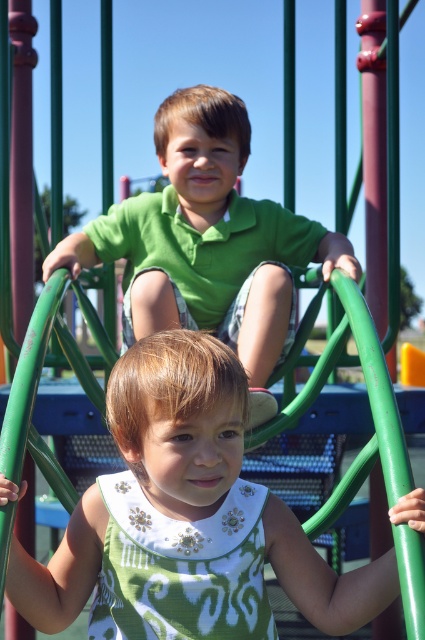
Is point (206, 404) positioned in front of point (303, 221)?

Yes, it is in front of point (303, 221).

Is green fabric dress at center closer to the viewer compared to green matte shirt at upper center?

Yes, it is.

Does point (135, 372) come closer to viewer compared to point (186, 96)?

That is True.

The image size is (425, 640). What are the coordinates of `green fabric dress at center` in the screenshot? It's located at (178, 420).